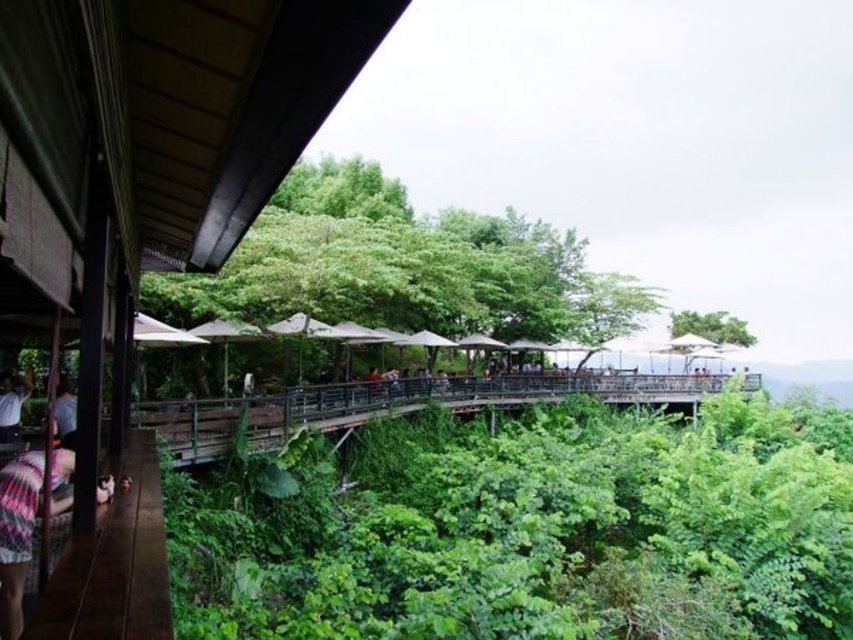
Can you confirm if plaid fabric at lower left is taller than white shirt at left?

Correct, plaid fabric at lower left is much taller as white shirt at left.

In the scene shown: Does plaid fabric at lower left lie behind white shirt at left?

No, it is not.

This screenshot has height=640, width=853. In order to click on plaid fabric at lower left in this screenshot , I will do `click(27, 520)`.

At what (x,y) coordinates should I click in order to perform the action: click on plaid fabric at lower left. Please return your answer as a coordinate pair (x, y). The width and height of the screenshot is (853, 640). Looking at the image, I should click on (27, 520).

Between green leafy vegetation at center and green leafy tree at upper center, which one appears on the right side from the viewer's perspective?

Positioned to the right is green leafy tree at upper center.

Between point (245, 593) and point (679, 321), which one is positioned in front?

Point (245, 593)

The width and height of the screenshot is (853, 640). In order to click on green leafy vegetation at center in this screenshot , I will do `click(531, 529)`.

Describe the element at coordinates (531, 529) in the screenshot. I see `green leafy vegetation at center` at that location.

Does green leafy vegetation at center have a smaller size compared to green leafy tree at center?

Yes, green leafy vegetation at center is smaller than green leafy tree at center.

Who is more distant from viewer, (844,458) or (538,321)?

Point (538,321)

Image resolution: width=853 pixels, height=640 pixels. In order to click on green leafy vegetation at center in this screenshot , I will do `click(531, 529)`.